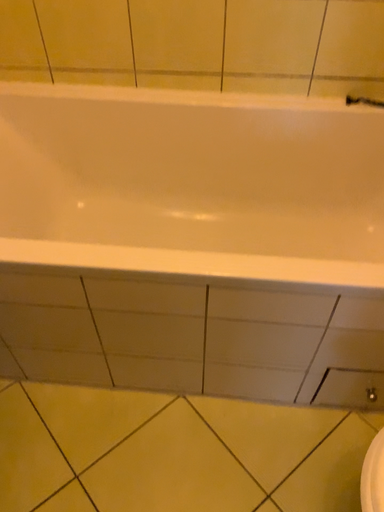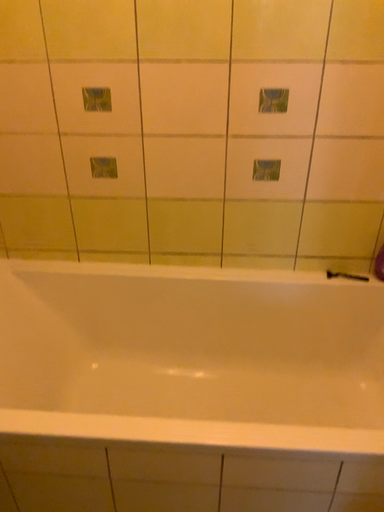
Question: Which way did the camera rotate in the video?

Choices:
 (A) rotated downward
 (B) rotated upward

Answer: (B)